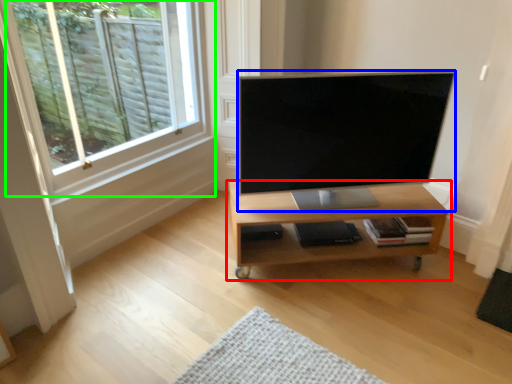
Question: Which object is positioned closest to shelf (highlighted by a red box)? Select from television (highlighted by a blue box) and window (highlighted by a green box).

Choices:
 (A) television
 (B) window

Answer: (A)